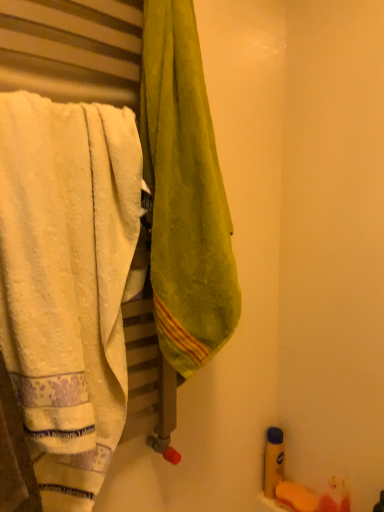
Question: Considering the relative sizes of white soft towel at left, acting as the 2th towel starting from the right, and green velvety towel at center, the second towel positioned from the left, in the image provided, is white soft towel at left, acting as the 2th towel starting from the right, shorter than green velvety towel at center, the second towel positioned from the left,?

Choices:
 (A) yes
 (B) no

Answer: (A)

Question: Does white soft towel at left, arranged as the first towel when viewed from the left, come behind green velvety towel at center, positioned as the first towel in right-to-left order?

Choices:
 (A) no
 (B) yes

Answer: (A)

Question: From a real-world perspective, is white soft towel at left, acting as the 2th towel starting from the right, positioned under green velvety towel at center, positioned as the first towel in right-to-left order, based on gravity?

Choices:
 (A) no
 (B) yes

Answer: (B)

Question: From the image's perspective, is white soft towel at left, arranged as the first towel when viewed from the left, located above green velvety towel at center, positioned as the first towel in right-to-left order?

Choices:
 (A) yes
 (B) no

Answer: (B)

Question: Is white soft towel at left, acting as the 2th towel starting from the right, at the right side of green velvety towel at center, the second towel positioned from the left?

Choices:
 (A) yes
 (B) no

Answer: (B)

Question: Visually, is white soft towel at left, acting as the 2th towel starting from the right, positioned to the left or to the right of green velvety towel at center, positioned as the first towel in right-to-left order?

Choices:
 (A) left
 (B) right

Answer: (A)

Question: In terms of width, does white soft towel at left, acting as the 2th towel starting from the right, look wider or thinner when compared to green velvety towel at center, positioned as the first towel in right-to-left order?

Choices:
 (A) wide
 (B) thin

Answer: (B)

Question: Does point (33, 360) appear closer or farther from the camera than point (211, 349)?

Choices:
 (A) closer
 (B) farther

Answer: (A)

Question: Looking at the image, does white soft towel at left, arranged as the first towel when viewed from the left, seem bigger or smaller compared to green velvety towel at center, the second towel positioned from the left?

Choices:
 (A) big
 (B) small

Answer: (A)

Question: From a real-world perspective, relative to white soft towel at left, arranged as the first towel when viewed from the left, is yellow matte bottle at lower right vertically above or below?

Choices:
 (A) above
 (B) below

Answer: (B)

Question: Is yellow matte bottle at lower right in front of or behind white soft towel at left, acting as the 2th towel starting from the right, in the image?

Choices:
 (A) front
 (B) behind

Answer: (B)

Question: Is yellow matte bottle at lower right taller or shorter than white soft towel at left, arranged as the first towel when viewed from the left?

Choices:
 (A) short
 (B) tall

Answer: (A)

Question: Which is correct: yellow matte bottle at lower right is inside white soft towel at left, acting as the 2th towel starting from the right, or outside of it?

Choices:
 (A) inside
 (B) outside

Answer: (B)

Question: In terms of height, does green velvety towel at center, positioned as the first towel in right-to-left order, look taller or shorter compared to white soft towel at left, arranged as the first towel when viewed from the left?

Choices:
 (A) tall
 (B) short

Answer: (A)

Question: Considering the positions of green velvety towel at center, positioned as the first towel in right-to-left order, and white soft towel at left, arranged as the first towel when viewed from the left, in the image, is green velvety towel at center, positioned as the first towel in right-to-left order, wider or thinner than white soft towel at left, arranged as the first towel when viewed from the left,?

Choices:
 (A) thin
 (B) wide

Answer: (B)